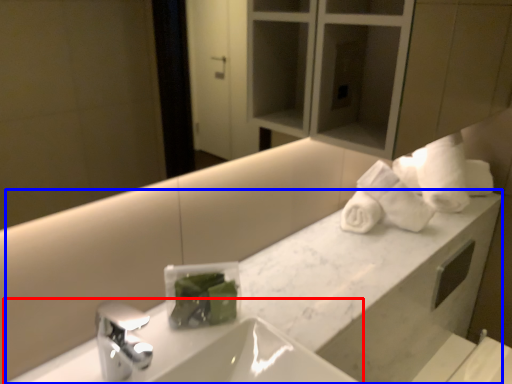
Question: Which point is closer to the camera, sink (highlighted by a red box) or counter (highlighted by a blue box)?

Choices:
 (A) sink
 (B) counter

Answer: (A)